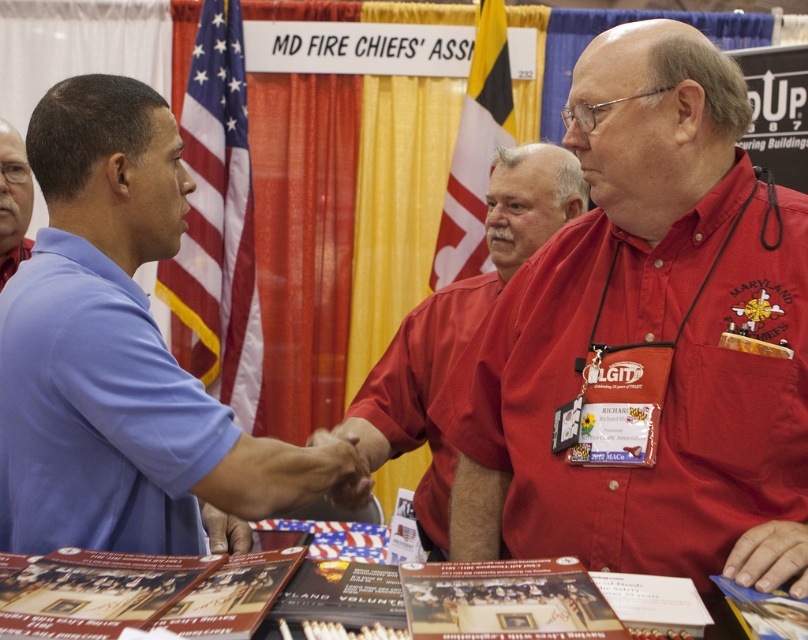
You are standing at the convention and want to take a photo of the point at coordinates (346, 413). The camera you have can focus on objects within 5 feet. Will the point be in focus?

The point at coordinates (346, 413) is 6.70 feet away from the camera, which is beyond the 5 feet focus range. Therefore, the point will not be in focus.

You are attending the Maryland Fire Chiefs Association event and notice the yellow fabric flag at upper center and the dark brown leather hand at center. Which object is taller in the image?

The yellow fabric flag at upper center is taller than the dark brown leather hand at center.